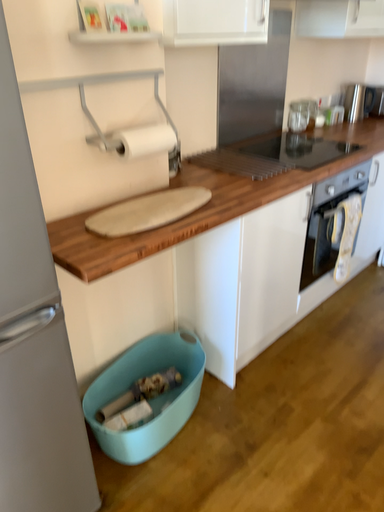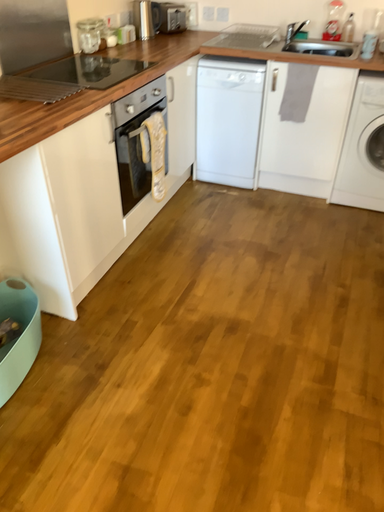
Question: Which way did the camera rotate in the video?

Choices:
 (A) rotated right
 (B) rotated left

Answer: (A)